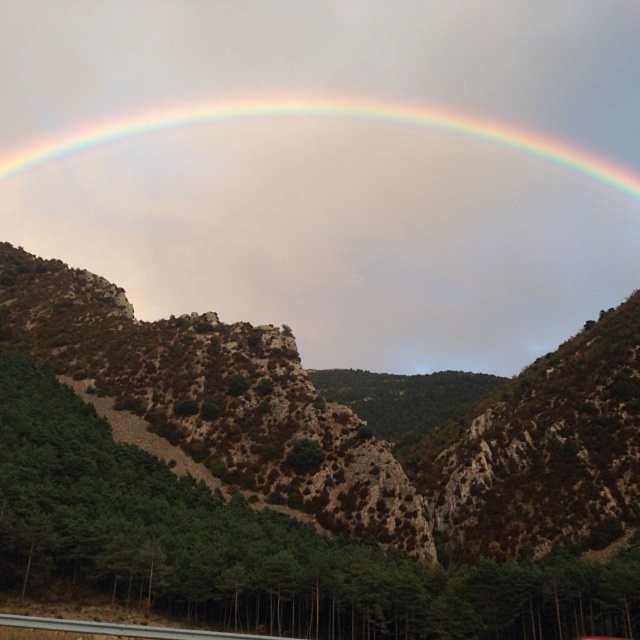
Question: From the image, what is the correct spatial relationship of rainbow at upper center in relation to gray concrete highway at lower center?

Choices:
 (A) above
 (B) below

Answer: (A)

Question: Considering the relative positions of rainbow at upper center and gray concrete highway at lower center in the image provided, where is rainbow at upper center located with respect to gray concrete highway at lower center?

Choices:
 (A) below
 (B) above

Answer: (B)

Question: Which object is closer to the camera taking this photo?

Choices:
 (A) rainbow at upper center
 (B) gray concrete highway at lower center

Answer: (B)

Question: Among these points, which one is farthest from the camera?

Choices:
 (A) (106, 632)
 (B) (83, 141)

Answer: (B)

Question: Does rainbow at upper center appear over gray concrete highway at lower center?

Choices:
 (A) yes
 (B) no

Answer: (A)

Question: Which point is farther from the camera taking this photo?

Choices:
 (A) (120, 129)
 (B) (120, 621)

Answer: (A)